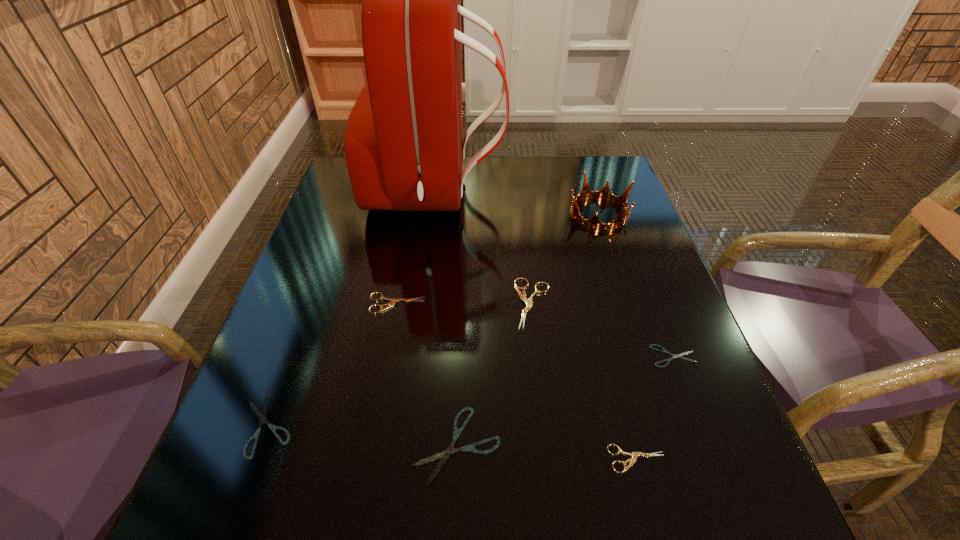
You are a GUI agent. You are given a task and a screenshot of the screen. Output one action in this format:
    pyautogui.click(x=<x>, y=<y>)
    Task: Click on the backpack
    
    Given the screenshot: What is the action you would take?
    pyautogui.click(x=404, y=149)

Find the location of a particular element. pink backpack is located at coordinates (404, 149).

In order to click on the seventh shortest object in this screenshot , I will do tap(605, 193).

The image size is (960, 540). What are the coordinates of `crown` in the screenshot? It's located at (605, 193).

The height and width of the screenshot is (540, 960). I want to click on the fifth object from left to right, so click(529, 302).

I want to click on the second beige shears from right to left, so click(529, 302).

The height and width of the screenshot is (540, 960). Find the location of `the leftmost beige shears`. the leftmost beige shears is located at coordinates tap(394, 300).

Where is `the fifth shortest object`? The height and width of the screenshot is (540, 960). the fifth shortest object is located at coordinates (394, 300).

Locate an element on the screen. This screenshot has height=540, width=960. the second black shears from left to right is located at coordinates (444, 455).

At what (x,y) coordinates should I click in order to perform the action: click on the biggest black shears. Please return your answer as a coordinate pair (x, y). This screenshot has width=960, height=540. Looking at the image, I should click on (444, 455).